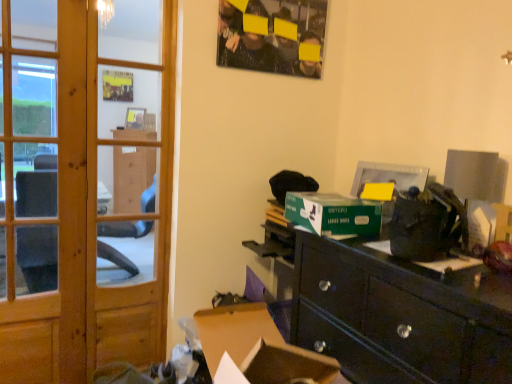
Question: Does point (247, 322) appear closer or farther from the camera than point (238, 11)?

Choices:
 (A) closer
 (B) farther

Answer: (A)

Question: From the image's perspective, relative to matte black poster at upper center, is brown cardboard box at lower center above or below?

Choices:
 (A) below
 (B) above

Answer: (A)

Question: Which object is positioned closest to the wooden door at left?

Choices:
 (A) wooden screen door at left
 (B) black glossy desk at lower right
 (C) brown cardboard box at lower center
 (D) matte black poster at upper center
 (E) green cardboard box at center

Answer: (D)

Question: Considering the real-world distances, which object is closest to the wooden screen door at left?

Choices:
 (A) brown cardboard box at lower center
 (B) black glossy desk at lower right
 (C) green cardboard box at center
 (D) matte black poster at upper center
 (E) wooden door at left

Answer: (E)